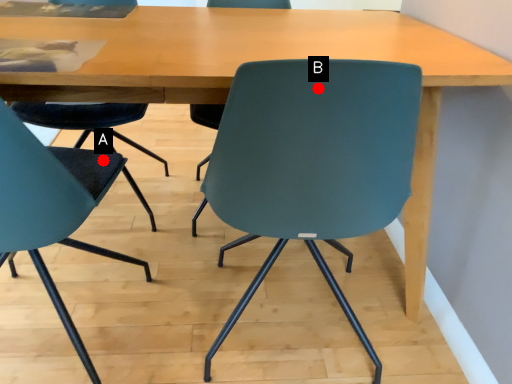
Question: Two points are circled on the image, labeled by A and B beside each circle. Which point appears closest to the camera in this image?

Choices:
 (A) A is closer
 (B) B is closer

Answer: (B)